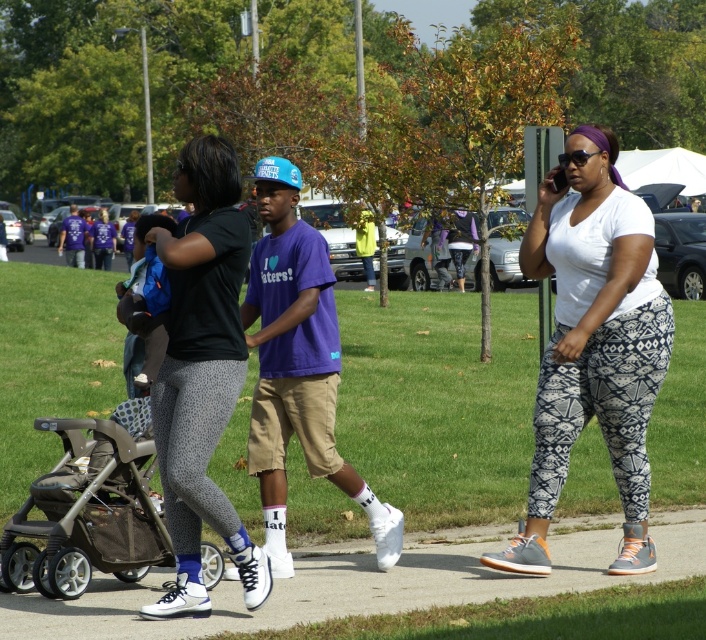
Question: Considering the relative positions of white concrete sidewalk at center and brown fabric stroller at lower left in the image provided, where is white concrete sidewalk at center located with respect to brown fabric stroller at lower left?

Choices:
 (A) below
 (B) above

Answer: (A)

Question: Does white concrete sidewalk at center have a smaller size compared to matte black leggings at center?

Choices:
 (A) yes
 (B) no

Answer: (B)

Question: Which point is farther to the camera?

Choices:
 (A) (198, 624)
 (B) (604, 177)

Answer: (B)

Question: Can you confirm if white printed leggings at center is positioned below matte black leggings at center?

Choices:
 (A) yes
 (B) no

Answer: (B)

Question: Which point is farther to the camera?

Choices:
 (A) matte black leggings at center
 (B) brown fabric stroller at lower left

Answer: (B)

Question: Which point is farther to the camera?

Choices:
 (A) (657, 536)
 (B) (213, 326)
 (C) (532, 214)

Answer: (A)